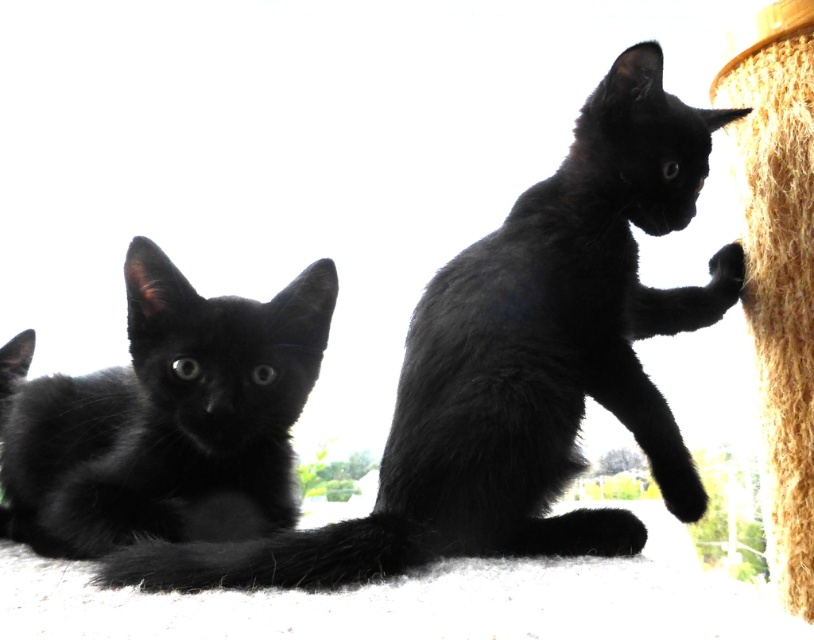
You are holding a toy mouse and want to toss it to the black fur cat at center. If the toy travels in a straight line, will it reach the cat before hitting any obstacles?

The black fur cat at center is 1.01 meters away from the viewer. Since there are no obstacles mentioned in the scene description, the toy mouse will reach the cat without any issues.

Consider the image. You are a photographer setting up a photo shoot for two kittens. You need to position a small platform so that both the black fur cat at center and the matte black kitten at left can comfortably stand on it. Given their sizes, which kitten will require a taller platform to ensure their feet don not touch the ground?

The black fur cat at center has a greater height compared to the matte black kitten at left, so it will require a taller platform to ensure its feet do not touch the ground.

You are a photographer setting up a photo shoot for two black fur cat at center and coarse straw rope at right. You need to ensure that the shorter object is placed in the foreground to create a depth effect. Which object should you place closer to the camera?

The black fur cat at center is shorter than the coarse straw rope at right, so you should place the black fur cat at center closer to the camera to achieve the desired depth effect.